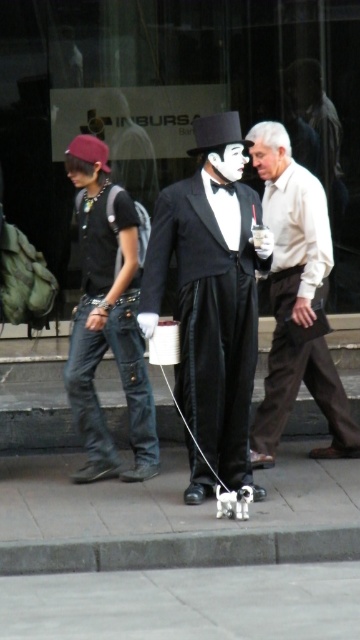
You are a costume designer examining the mime performer in the scene. You need to adjust the proportions of the matte white shirt at center and the black satin bow tie at center so that they are the same height. Which object should you modify and how?

The matte white shirt at center is taller than the black satin bow tie at center. To make them the same height, you should shorten the matte white shirt at center or lengthen the black satin bow tie at center.

You are a photographer standing in front of the street scene. You want to take a photo of the matte white shirt at center and the black satin bow tie at center. Which object will appear closer to you in the photo?

The matte white shirt at center will appear closer to you in the photo because it is further to the viewer than the black satin bow tie at center.